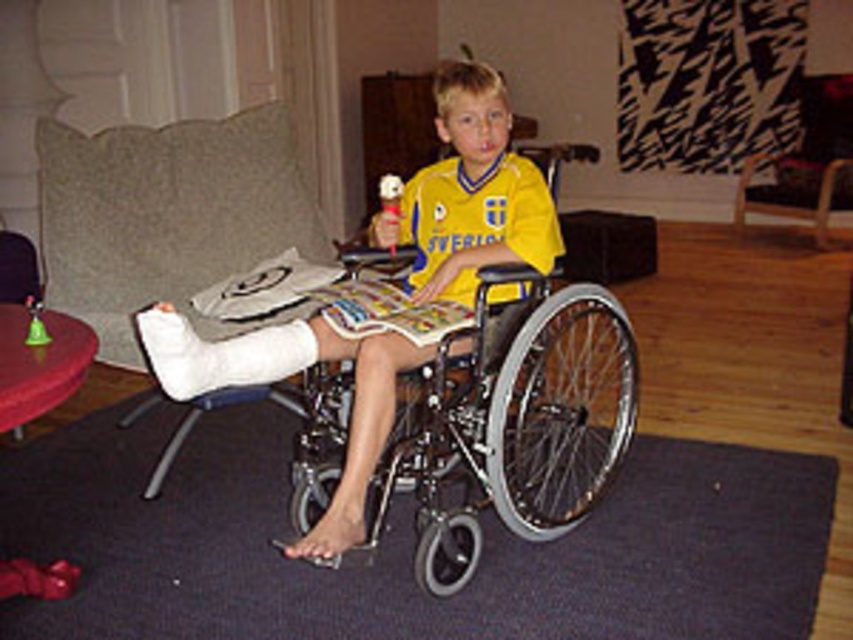
Does silver metallic wheelchair at center have a larger size compared to white cast at left?

Yes.

Which is behind, point (509, 490) or point (274, 216)?

Point (274, 216)

At what (x,y) coordinates should I click in order to perform the action: click on silver metallic wheelchair at center. Please return your answer as a coordinate pair (x, y). The width and height of the screenshot is (853, 640). Looking at the image, I should click on (509, 420).

Which is behind, point (554, 582) or point (144, 237)?

The point (144, 237) is more distant.

Consider the image. Does dark gray carpet at lower center appear on the left side of white cast at left?

Incorrect, dark gray carpet at lower center is not on the left side of white cast at left.

At what (x,y) coordinates should I click in order to perform the action: click on dark gray carpet at lower center. Please return your answer as a coordinate pair (x, y). This screenshot has height=640, width=853. Looking at the image, I should click on (404, 545).

Can you confirm if metallic wheelchair at center is shorter than brown leather armchair at upper right?

No, metallic wheelchair at center is not shorter than brown leather armchair at upper right.

Who is taller, metallic wheelchair at center or brown leather armchair at upper right?

With more height is metallic wheelchair at center.

What do you see at coordinates (389, 291) in the screenshot?
I see `metallic wheelchair at center` at bounding box center [389, 291].

Locate an element on the screen. The width and height of the screenshot is (853, 640). metallic wheelchair at center is located at coordinates (389, 291).